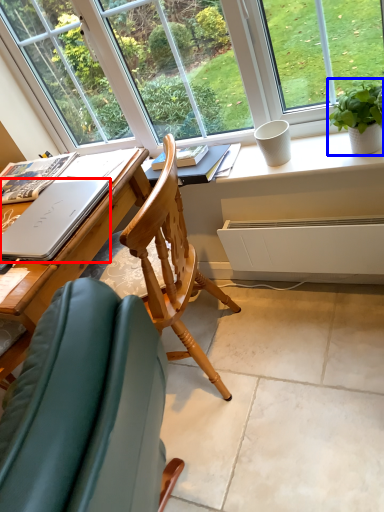
Question: Which object appears closest to the camera in this image, laptop (highlighted by a red box) or houseplant (highlighted by a blue box)?

Choices:
 (A) laptop
 (B) houseplant

Answer: (A)